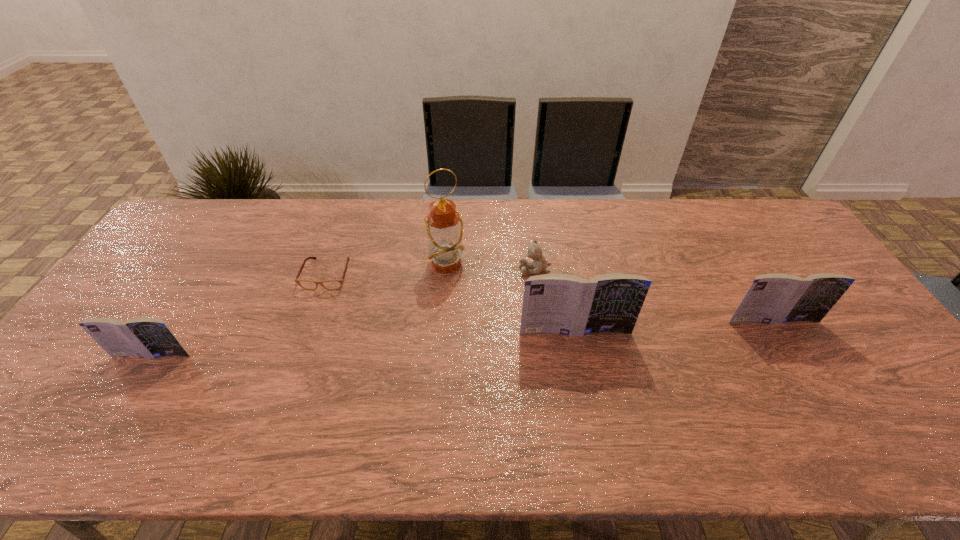
If we want them evenly spaced by inserting an extra book among them, please locate a free spot for this new book. Please provide its 2D coordinates. Your answer should be formatted as a tuple, i.e. [(x, y)], where the tuple contains the x and y coordinates of a point satisfying the conditions above.

[(369, 343)]